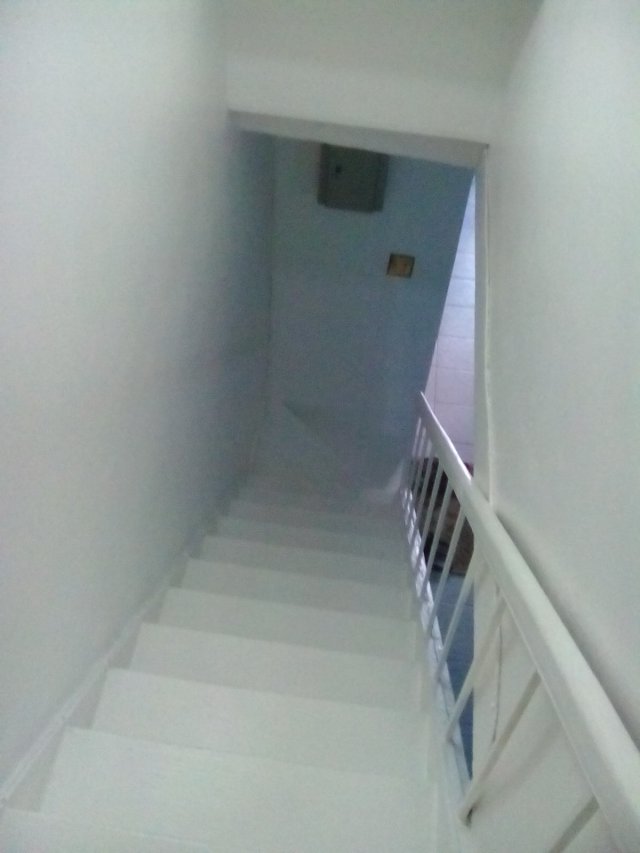
Where is `walls`? walls is located at coordinates (125, 369), (324, 323), (564, 409).